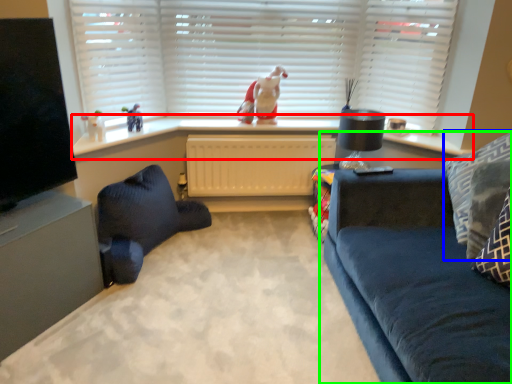
Question: Considering the real-world distances, which object is farthest from window sill (highlighted by a red box)? pillow (highlighted by a blue box) or studio couch (highlighted by a green box)?

Choices:
 (A) pillow
 (B) studio couch

Answer: (B)